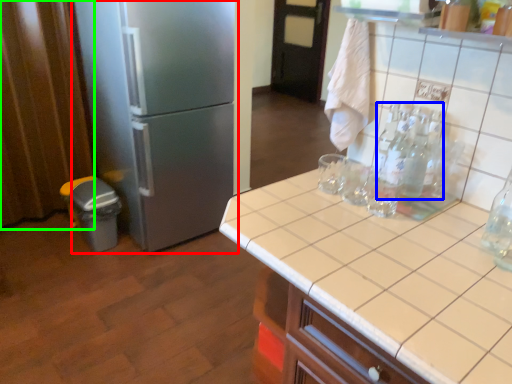
Question: Which is nearer to the refrigerator (highlighted by a red box)? bottle (highlighted by a blue box) or curtain (highlighted by a green box).

Choices:
 (A) bottle
 (B) curtain

Answer: (B)